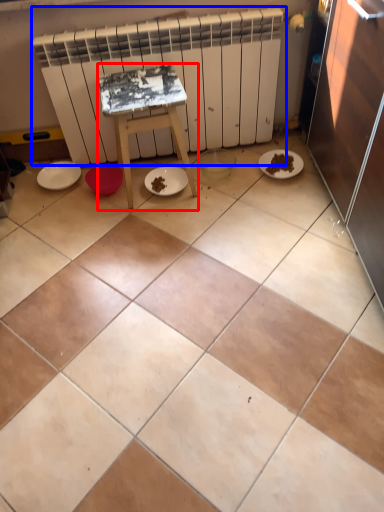
Question: Which object appears closest to the camera in this image, furniture (highlighted by a red box) or radiator (highlighted by a blue box)?

Choices:
 (A) furniture
 (B) radiator

Answer: (A)